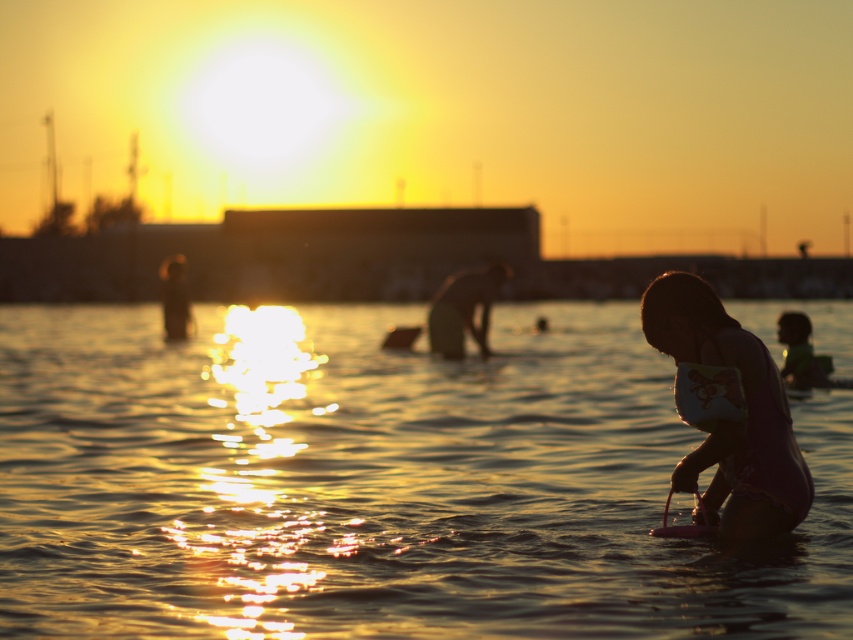
Question: Is translucent golden water at center bigger than smooth skin person at center?

Choices:
 (A) yes
 (B) no

Answer: (A)

Question: Is pink matte swimsuit at lower right behind smooth skin person at center?

Choices:
 (A) no
 (B) yes

Answer: (A)

Question: Can you confirm if translucent golden water at center is positioned to the left of smooth skin person at center?

Choices:
 (A) no
 (B) yes

Answer: (A)

Question: Based on their relative distances, which object is farther from the pink matte swimsuit at lower right?

Choices:
 (A) silhouette human at left
 (B) smooth skin person at center

Answer: (A)

Question: Considering the real-world distances, which object is closest to the smooth skin person at center?

Choices:
 (A) translucent golden water at center
 (B) silhouette human at left
 (C) pink matte swimsuit at lower right

Answer: (B)

Question: Estimate the real-world distances between objects in this image. Which object is farther from the pink matte swimsuit at lower right?

Choices:
 (A) silhouette human at left
 (B) smooth skin person at center

Answer: (A)